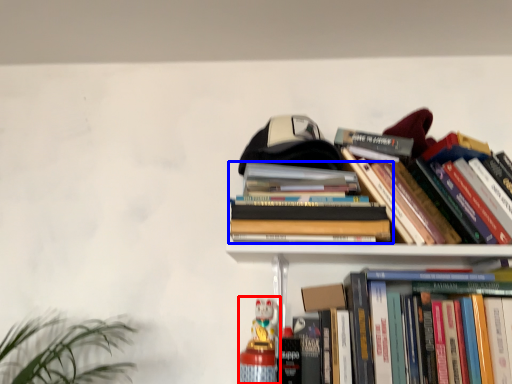
Question: Which point is further to the camera, toy (highlighted by a red box) or book (highlighted by a blue box)?

Choices:
 (A) toy
 (B) book

Answer: (A)